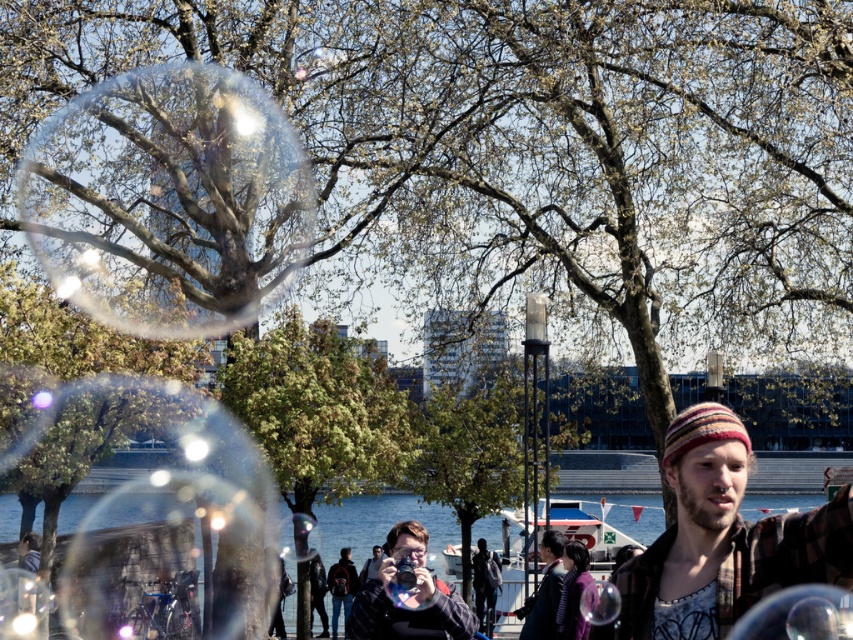
Consider the image. Who is positioned more to the left, transparent glass bubble at upper left or matte black camera at center?

Positioned to the left is transparent glass bubble at upper left.

Which is more to the right, transparent glass bubble at upper left or matte black camera at center?

matte black camera at center

This screenshot has width=853, height=640. Identify the location of transparent glass bubble at upper left. (167, 202).

Does plaid flannel shirt at right appear under matte black camera at center?

No, plaid flannel shirt at right is not below matte black camera at center.

Is point (666, 454) farther from camera compared to point (418, 582)?

No, it is in front of (418, 582).

Identify the location of plaid flannel shirt at right. (723, 538).

This screenshot has height=640, width=853. I want to click on transparent glass bubble at upper left, so click(167, 202).

Does transparent glass bubble at upper left appear on the left side of plaid flannel shirt at right?

Correct, you'll find transparent glass bubble at upper left to the left of plaid flannel shirt at right.

Between point (126, 195) and point (828, 566), which one is positioned in front?

Positioned in front is point (828, 566).

Where is `transparent glass bubble at upper left`? transparent glass bubble at upper left is located at coordinates (167, 202).